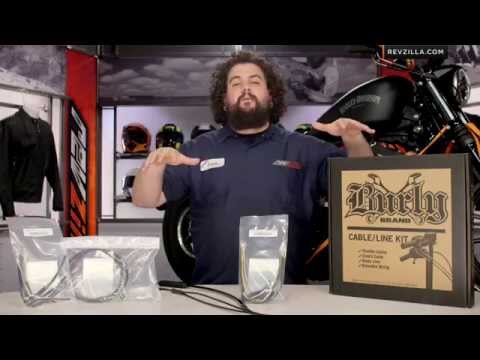
At what (x,y) coordinates should I click in order to perform the action: click on table. Please return your answer as a coordinate pair (x, y). Looking at the image, I should click on (312, 300).